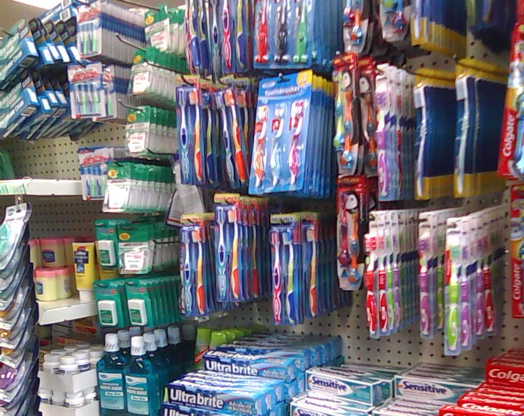
Find the location of a particular element. Image resolution: width=524 pixels, height=416 pixels. light is located at coordinates point(41,3).